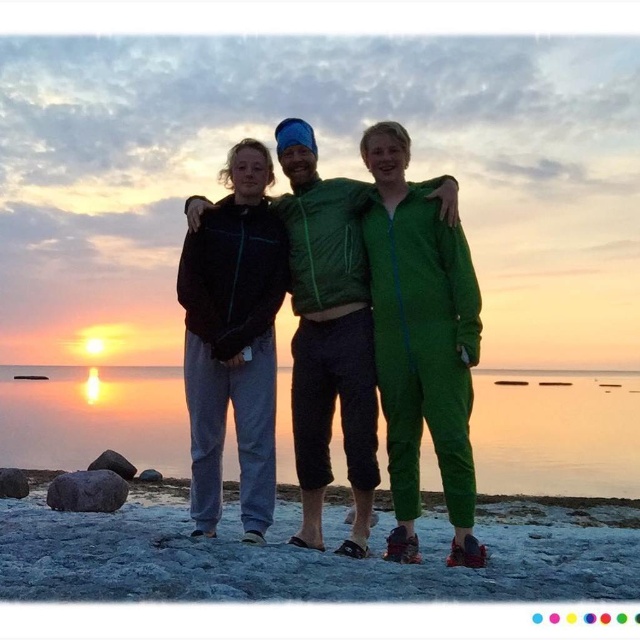
You are standing on the beach and see two points in the scene. The first point is at coordinate point (570, 396) and the second point is at coordinate point (332, 204). Which point is closer to you?

Point (570, 396) is further to the viewer than point (332, 204), so the second point is closer to you.

Consider the image. You are a photographer trying to capture the three friends in the sunset scene. You notice the green matte jumpsuit at center and the matte black jacket at center. Which friend is standing to the right of the other?

The green matte jumpsuit at center is positioned on the right side of the matte black jacket at center, so the friend in the green matte jumpsuit at center is standing to the right of the friend in the matte black jacket at center.